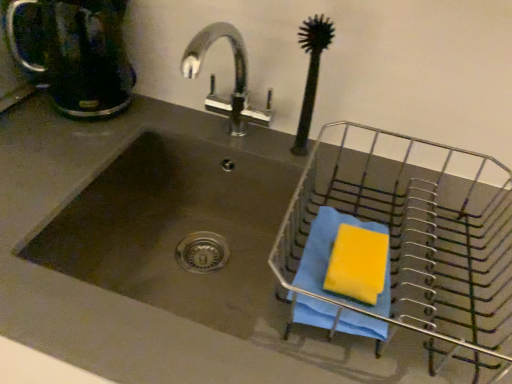
This screenshot has height=384, width=512. I want to click on vacant area that is situated to the right of matte black coffeepot at upper left, so click(158, 114).